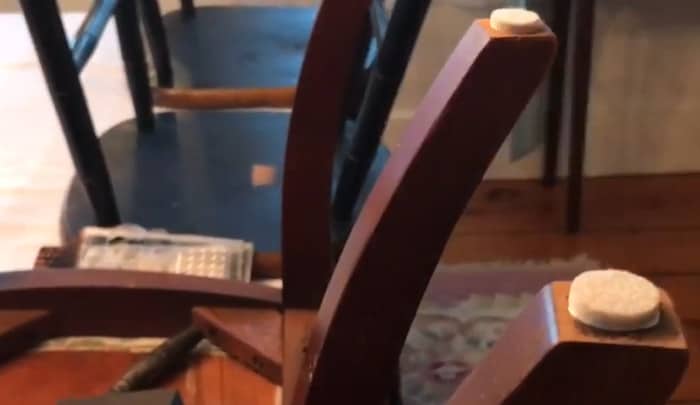
Identify the location of rug. (448, 330).